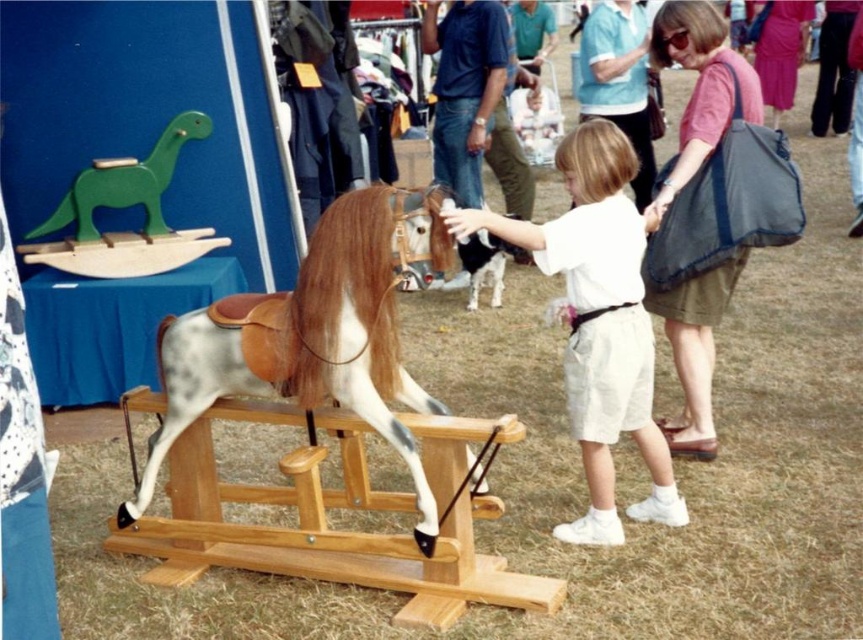
Is point (326, 348) in front of point (559, 236)?

Yes, point (326, 348) is in front of point (559, 236).

Does speckled wood horse at center have a greater height compared to white cotton shirt at center?

No.

Is point (401, 196) in front of point (603, 294)?

Yes.

Identify the location of speckled wood horse at center. (313, 336).

Can you confirm if white cotton shirt at center is bigger than green wooden dinosaur at upper left?

Indeed, white cotton shirt at center has a larger size compared to green wooden dinosaur at upper left.

Between point (584, 262) and point (158, 204), which one is positioned behind?

The point (158, 204) is more distant.

Does point (565, 216) come behind point (165, 148)?

No.

At what (x,y) coordinates should I click in order to perform the action: click on white cotton shirt at center. Please return your answer as a coordinate pair (x, y). This screenshot has height=640, width=863. Looking at the image, I should click on (597, 323).

Looking at this image, between speckled wood horse at center and green wooden dinosaur at upper left, which one has more height?

speckled wood horse at center

Is speckled wood horse at center positioned at the back of green wooden dinosaur at upper left?

No.

Describe the element at coordinates (313, 336) in the screenshot. I see `speckled wood horse at center` at that location.

The width and height of the screenshot is (863, 640). Find the location of `speckled wood horse at center`. speckled wood horse at center is located at coordinates (313, 336).